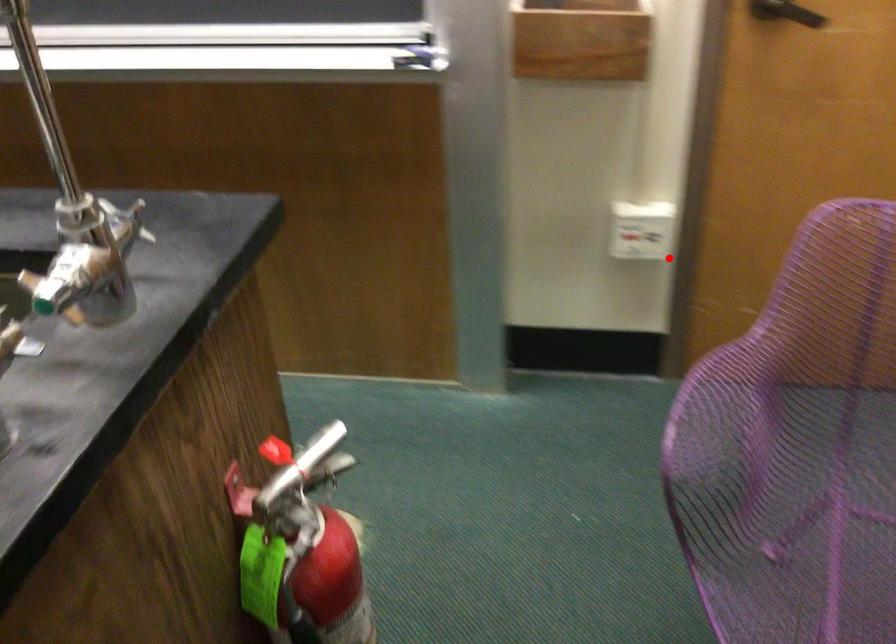
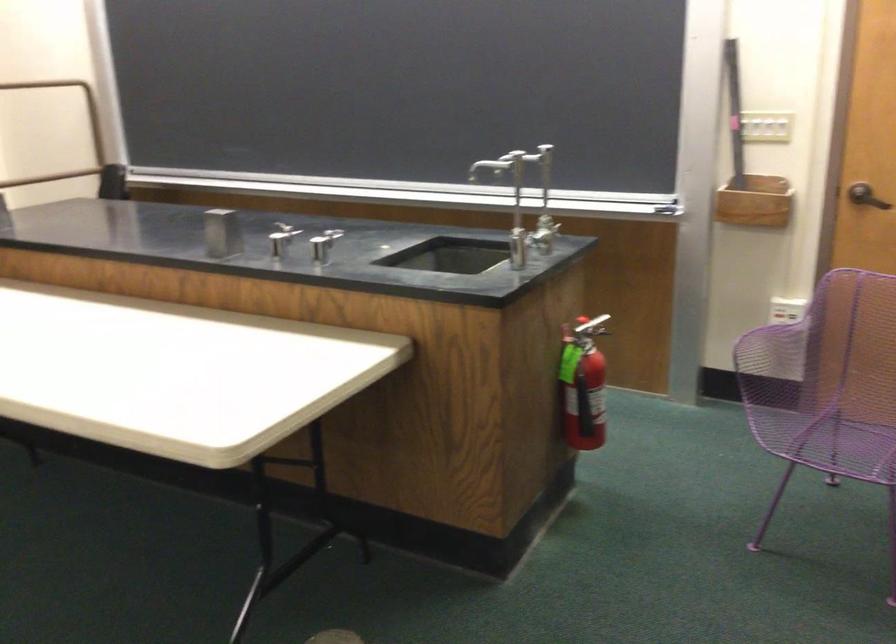
Find the pixel in the second image that matches the highlighted location in the first image.

(787, 310)